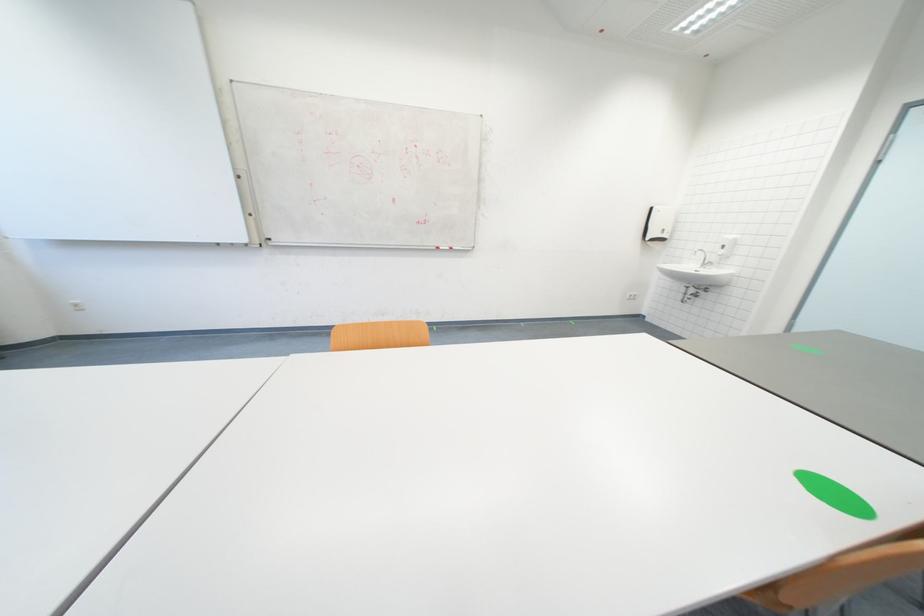
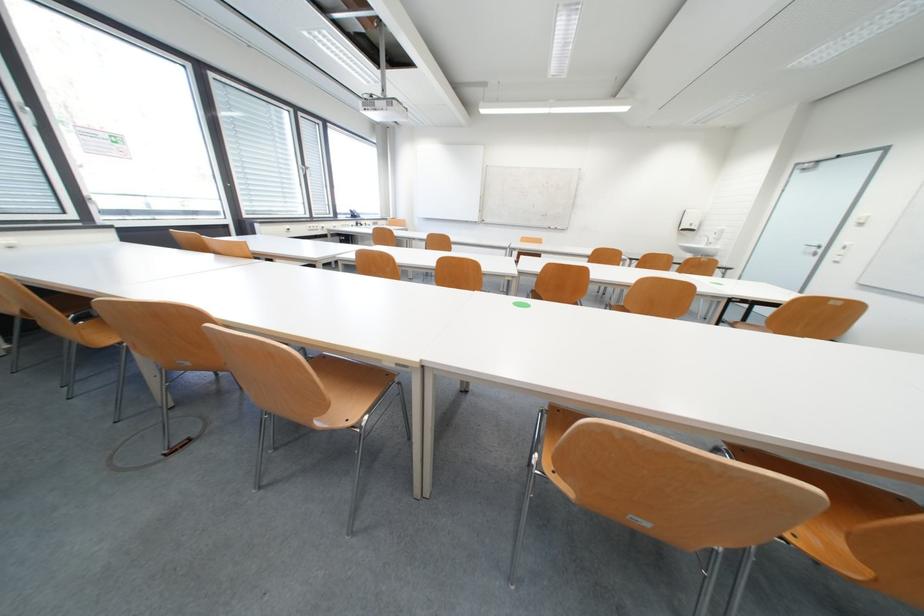
Question: What movement of the cameraman would produce the second image?

Choices:
 (A) Left
 (B) Right
 (C) Forward
 (D) Backward

Answer: (D)